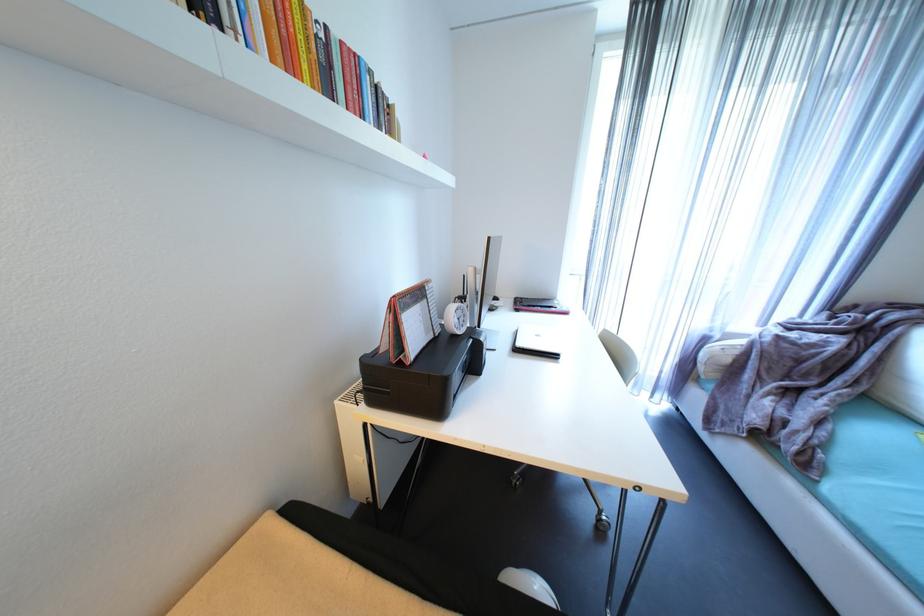
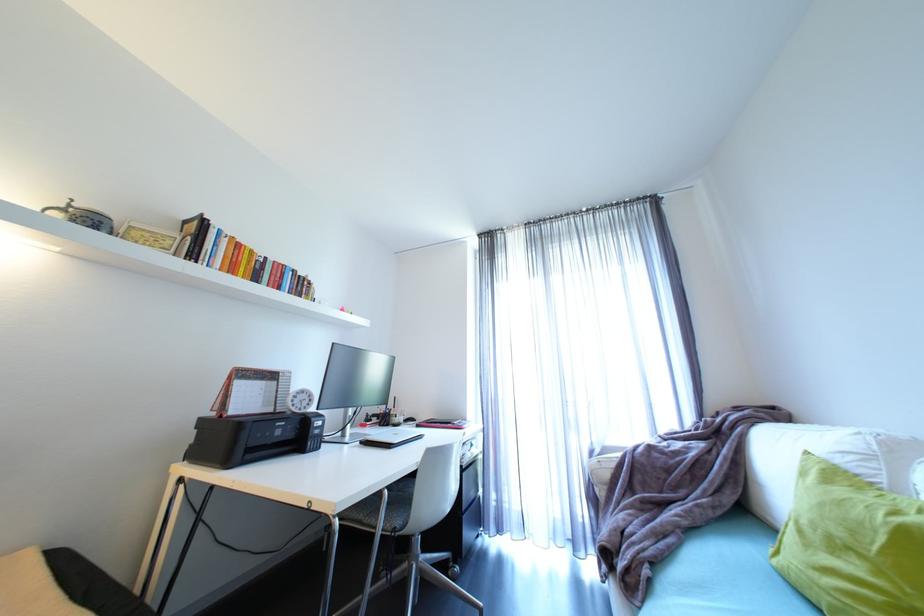
Locate, in the second image, the point that corresponds to point 407,363 in the first image.

(228, 416)